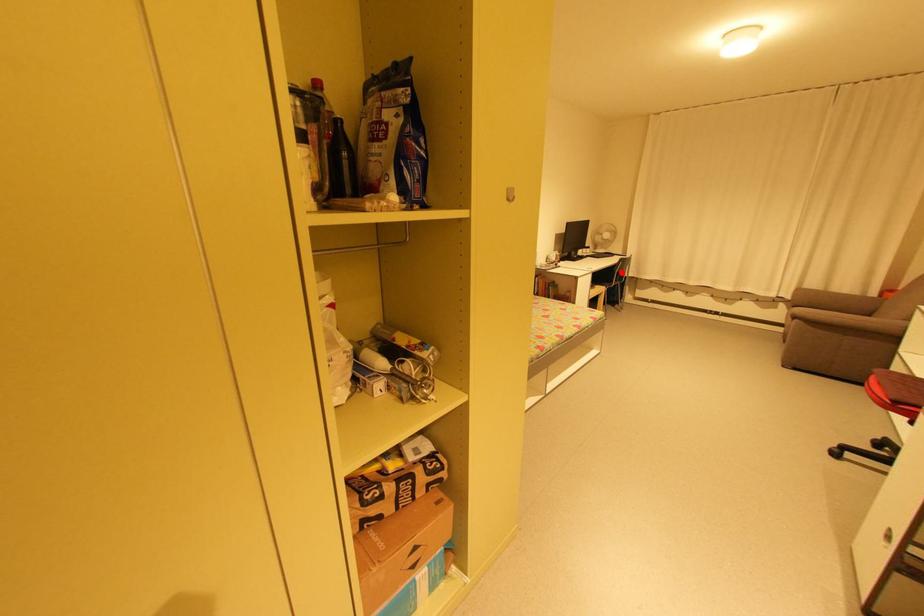
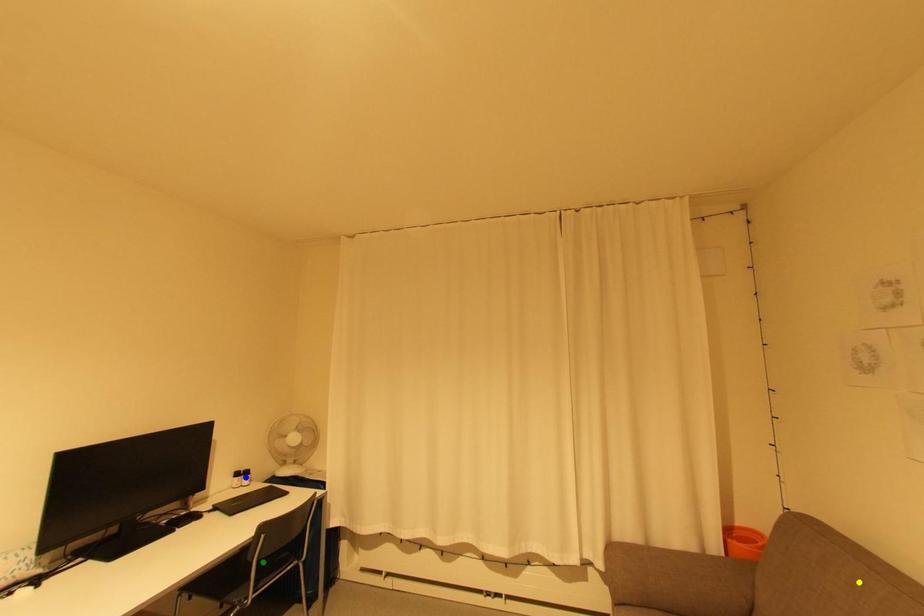
Question: I am providing you with two images of the same scene from different viewpoints. A red point is marked on the first image. You are given multiple points on the second image. Can you choose the point in image 2 that corresponds to the point in image 1?

Choices:
 (A) yellow point
 (B) green point
 (C) blue point

Answer: (B)